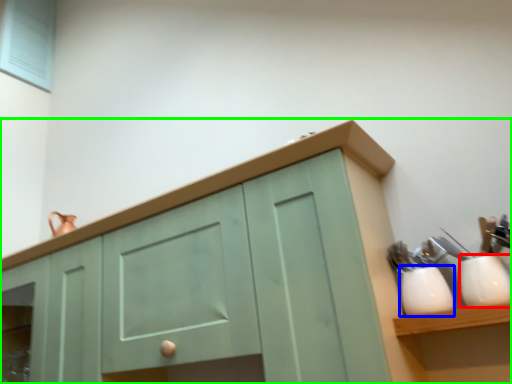
Question: Which is nearer to the tableware (highlighted by a red box)? tableware (highlighted by a blue box) or cabinetry (highlighted by a green box).

Choices:
 (A) tableware
 (B) cabinetry

Answer: (A)